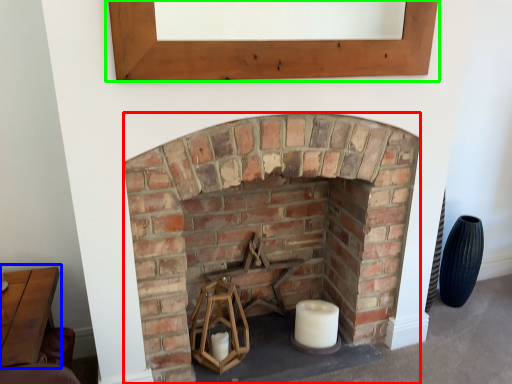
Question: Which object is positioned farthest from fireplace (highlighted by a red box)? Select from table (highlighted by a blue box) and window frame (highlighted by a green box).

Choices:
 (A) table
 (B) window frame

Answer: (A)